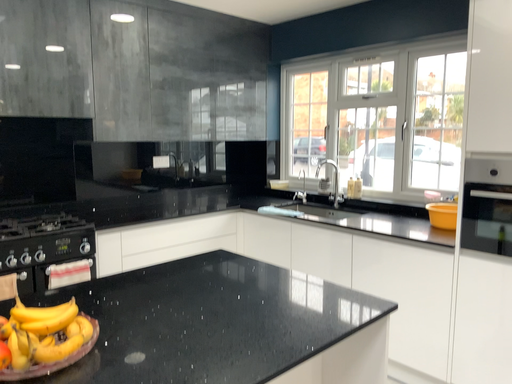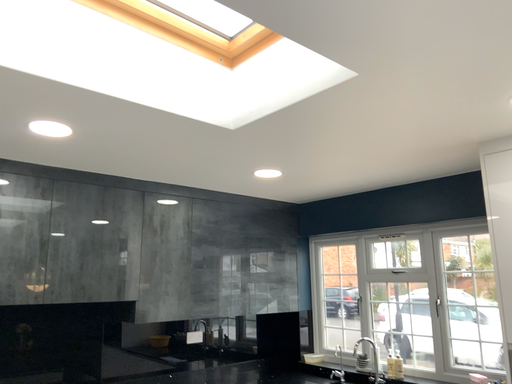
Question: How did the camera likely rotate when shooting the video?

Choices:
 (A) rotated upward
 (B) rotated downward

Answer: (A)